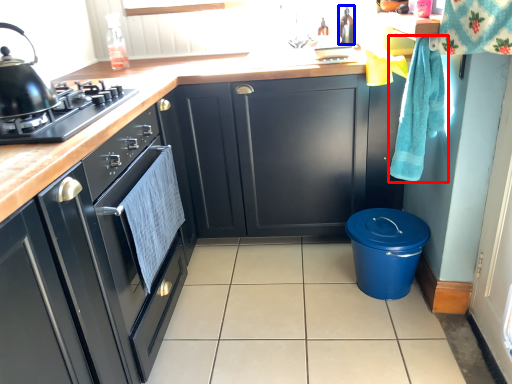
Question: Which of the following is the farthest to the observer, hand towel (highlighted by a red box) or appliance (highlighted by a blue box)?

Choices:
 (A) hand towel
 (B) appliance

Answer: (B)